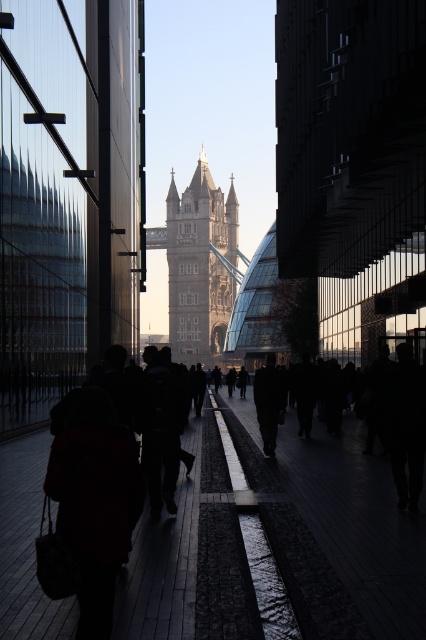
You are planning to cross the dark gray concrete pavement at center to reach the Tower Bridge. The bridge is 191.64 feet away from you. If your walking speed is 3 feet per second, how many seconds will it take you to reach the bridge?

It will take approximately 63.88 seconds to reach the Tower Bridge because 191.64 divided by 3 equals 63.88 seconds.

You are standing on the walkway and notice both the dark gray concrete pavement at center and the dark fabric coat at center. Which object is positioned lower relative to the other?

The dark gray concrete pavement at center is located below the dark fabric coat at center, so it is positioned lower.